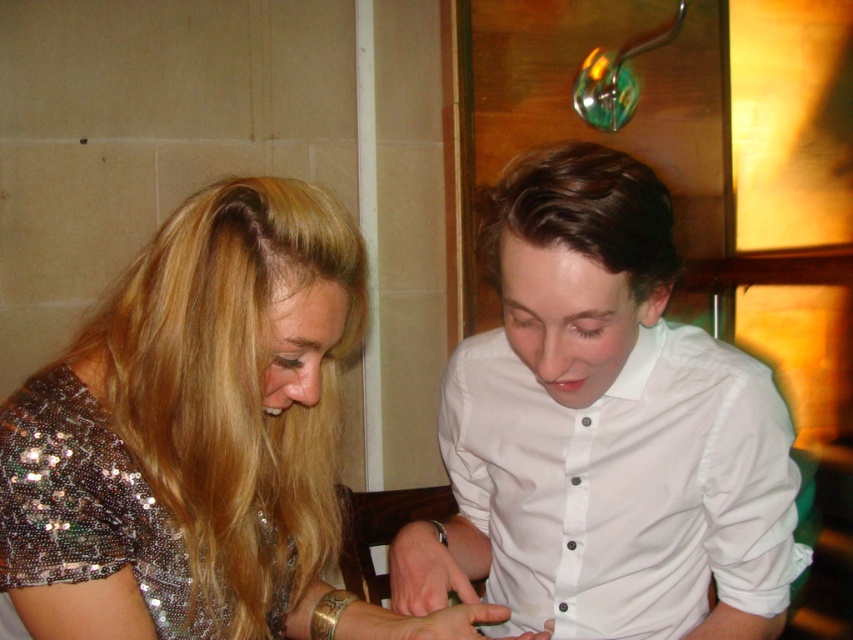
You are a photographer trying to capture a closeup of the shiny sequined dress at center. The camera you are using has a fixed focus that can only capture objects within a 0.1 radius around the point at coordinates point (210, 419). Will the dress be in focus?

The shiny sequined dress at center is located exactly at point (210, 419), so the dress will be in focus since it is within the camera focus radius of 0.1 around that point.

You are a photographer trying to capture both the shiny sequined dress at center and the sparkly sequined dress at lower left in the same frame. Based on their positions, which dress should you focus on first to ensure both are in the shot?

The shiny sequined dress at center is to the right of the sparkly sequined dress at lower left, so you should focus on the sparkly sequined dress at lower left first to ensure both are in the frame.